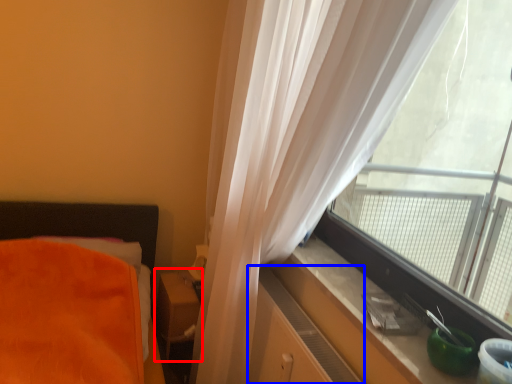
Question: Which object is further to the camera taking this photo, table (highlighted by a red box) or dresser (highlighted by a blue box)?

Choices:
 (A) table
 (B) dresser

Answer: (A)